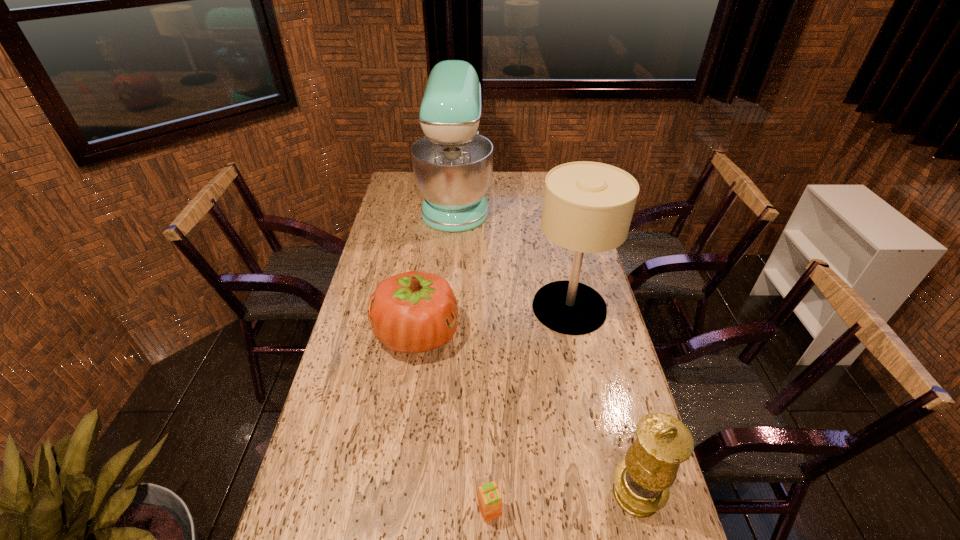
You are a GUI agent. You are given a task and a screenshot of the screen. Output one action in this format:
    pyautogui.click(x=<x>, y=<y>)
    Task: Click on the free space between the table lamp and the farthest object
    The height and width of the screenshot is (540, 960).
    Given the screenshot: What is the action you would take?
    pyautogui.click(x=513, y=254)

The image size is (960, 540). Find the location of `free space between the pumpkin and the farthest object`. free space between the pumpkin and the farthest object is located at coordinates (437, 267).

This screenshot has height=540, width=960. Identify the location of unoccupied position between the farthest object and the table lamp. (513, 254).

What are the coordinates of `unoccupied area between the farthest object and the table lamp` in the screenshot? It's located at (513, 254).

Where is `free space that is in between the pumpkin and the table lamp`? free space that is in between the pumpkin and the table lamp is located at coordinates (493, 321).

The height and width of the screenshot is (540, 960). I want to click on free space between the table lamp and the oil lamp, so click(x=603, y=401).

Find the location of a particular element. blank region between the mixer and the shortest object is located at coordinates (472, 355).

The height and width of the screenshot is (540, 960). What are the coordinates of `empty location between the mixer and the table lamp` in the screenshot? It's located at (513, 254).

Locate an element on the screen. The height and width of the screenshot is (540, 960). vacant region between the pumpkin and the shortest object is located at coordinates (453, 422).

In order to click on object that stands as the fourth closest to the table lamp in this screenshot , I will do `click(489, 498)`.